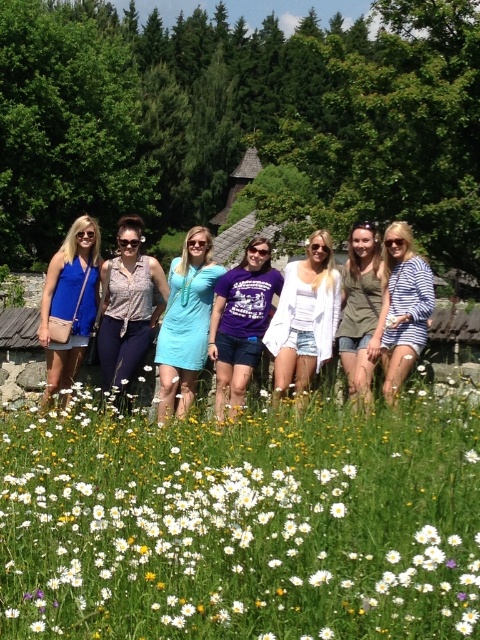
Question: Can you confirm if matte blue dress at left is smaller than striped cotton shirt at center?

Choices:
 (A) no
 (B) yes

Answer: (A)

Question: Which of these objects is positioned farthest from the white cotton shorts at center?

Choices:
 (A) green grass at lower center
 (B) white soft daisy at center

Answer: (B)

Question: Which point is closer to the camera?

Choices:
 (A) (168, 401)
 (B) (82, 310)

Answer: (A)

Question: Considering the relative positions of green grass at lower center and matte olive green shirt at center in the image provided, where is green grass at lower center located with respect to matte olive green shirt at center?

Choices:
 (A) above
 (B) below

Answer: (B)

Question: Can you confirm if matte blue dress at center is wider than white soft daisy at center?

Choices:
 (A) yes
 (B) no

Answer: (A)

Question: Which point is closer to the camera taking this photo?

Choices:
 (A) (402, 276)
 (B) (384, 566)

Answer: (B)